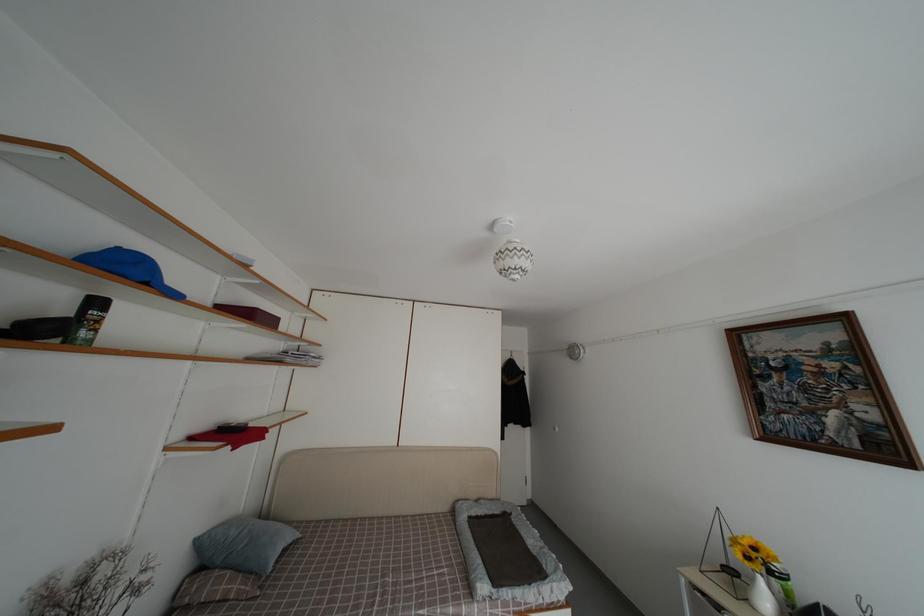
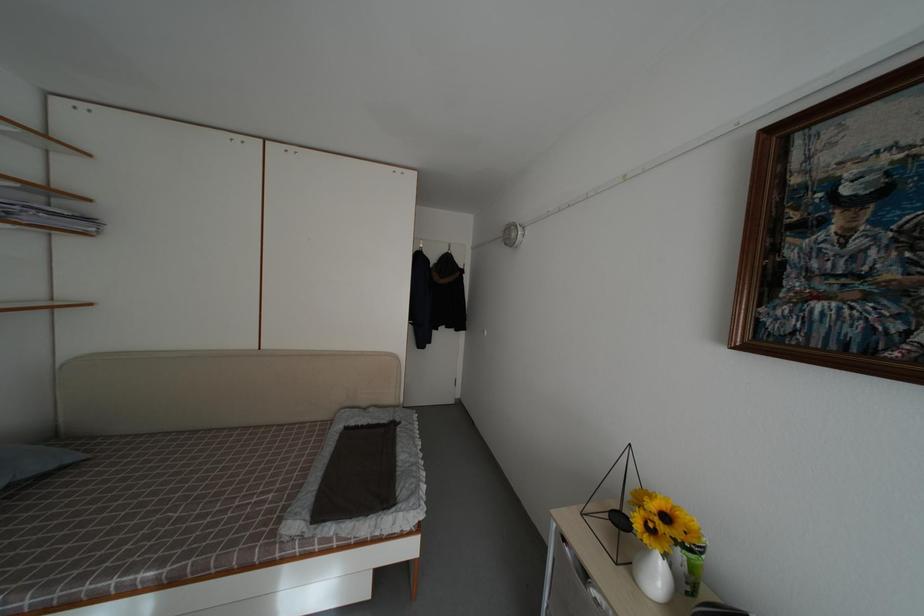
In the second image, find the point that corresponds to point 304,541 in the first image.

(80, 464)